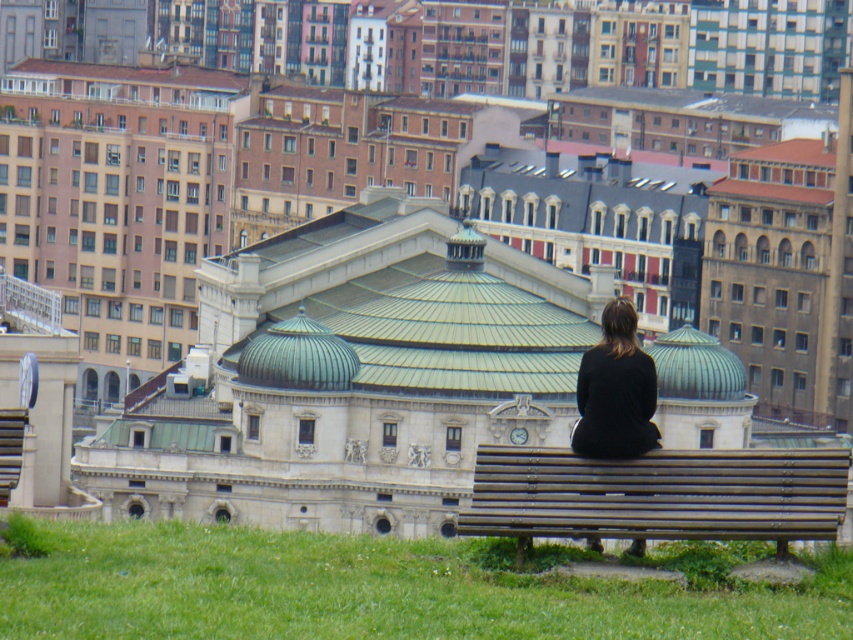
Question: Can you confirm if brown wooden bench at lower right is wider than black matte dress at lower right?

Choices:
 (A) no
 (B) yes

Answer: (B)

Question: Is brown wooden bench at lower right bigger than black matte dress at lower right?

Choices:
 (A) yes
 (B) no

Answer: (A)

Question: Which point is closer to the camera?

Choices:
 (A) (786, 524)
 (B) (578, 448)

Answer: (A)

Question: Does brown wooden bench at lower right have a greater width compared to black matte dress at lower right?

Choices:
 (A) yes
 (B) no

Answer: (A)